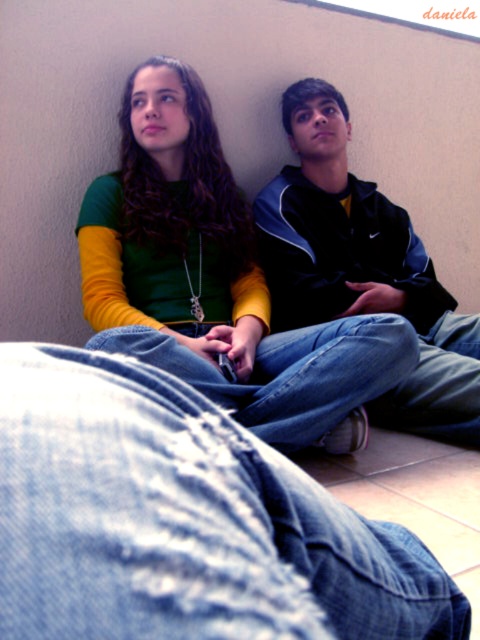
You are a photographer setting up for a portrait. You have two subjects wearing the matte green shirt at upper left and denim at center. To ensure both subjects are in focus, you need to know which one is taller. Which subject is taller?

The matte green shirt at upper left is taller than denim at center, so the subject wearing the matte green shirt at upper left is taller.

From the picture: You are standing in front of the image and want to place a small sticker between the matte green shirt at upper left and the denim at center. According to their positions, which object should the sticker be closer to?

The sticker should be placed closer to the denim at center because the matte green shirt at upper left is to the left of denim at center, meaning the denim is on the right side, so the sticker would be between them but closer to the denim.

You are designing a new clothing line and want to ensure that the matte green shirt at upper left and the denim at center can be worn together. Based on their sizes, which one would you recommend as the main focal point?

The matte green shirt at upper left has a larger size compared to denim at center, so it would naturally draw more attention and should be the main focal point in the outfit.